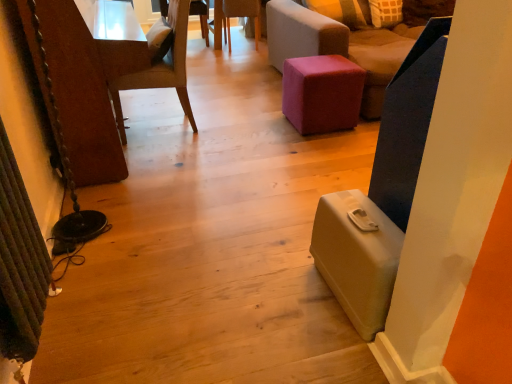
You are a GUI agent. You are given a task and a screenshot of the screen. Output one action in this format:
    pyautogui.click(x=<x>, y=<y>)
    Task: Click on the free region on the left part of matte green suitcase at lower right
    The image size is (512, 384).
    Given the screenshot: What is the action you would take?
    pyautogui.click(x=265, y=294)